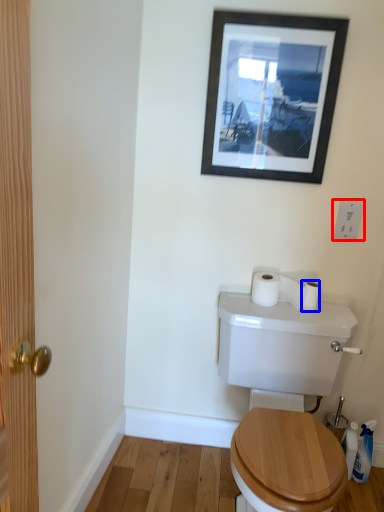
Question: Which object appears farthest to the camera in this image, electric outlet (highlighted by a red box) or toilet paper (highlighted by a blue box)?

Choices:
 (A) electric outlet
 (B) toilet paper

Answer: (B)